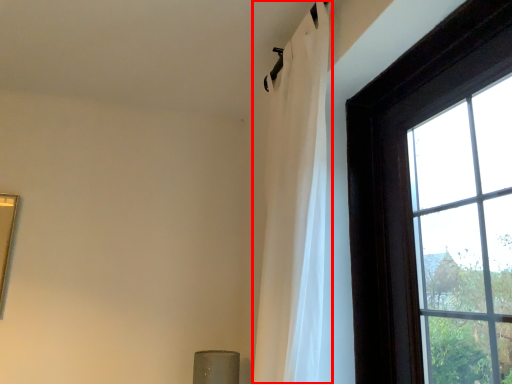
Question: From the image's perspective, where is curtain (annotated by the red box) located relative to window?

Choices:
 (A) below
 (B) above

Answer: (B)